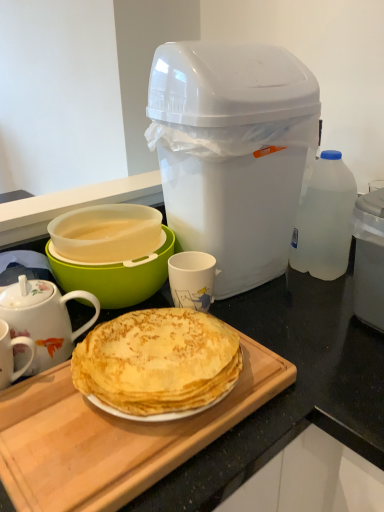
Question: Is wooden cutting board at center shorter than transparent plastic bottle at right?

Choices:
 (A) yes
 (B) no

Answer: (A)

Question: Is wooden cutting board at center positioned before transparent plastic bottle at right?

Choices:
 (A) no
 (B) yes

Answer: (B)

Question: From a real-world perspective, is wooden cutting board at center positioned under transparent plastic bottle at right based on gravity?

Choices:
 (A) no
 (B) yes

Answer: (B)

Question: Is wooden cutting board at center next to transparent plastic bottle at right and touching it?

Choices:
 (A) yes
 (B) no

Answer: (B)

Question: Does wooden cutting board at center turn towards transparent plastic bottle at right?

Choices:
 (A) yes
 (B) no

Answer: (B)

Question: Is translucent plastic bowl at center left in front of or behind white matte mug at center in the image?

Choices:
 (A) behind
 (B) front

Answer: (B)

Question: Considering the positions of point (163, 259) and point (188, 276), is point (163, 259) closer or farther from the camera than point (188, 276)?

Choices:
 (A) closer
 (B) farther

Answer: (B)

Question: Considering the positions of translucent plastic bowl at center left and white matte mug at center in the image, is translucent plastic bowl at center left wider or thinner than white matte mug at center?

Choices:
 (A) thin
 (B) wide

Answer: (B)

Question: From a real-world perspective, is translucent plastic bowl at center left positioned above or below white matte mug at center?

Choices:
 (A) below
 (B) above

Answer: (B)

Question: From the image's perspective, is white plastic trash can at upper right above or below porcelain floral teapot at left?

Choices:
 (A) above
 (B) below

Answer: (A)

Question: Would you say white plastic trash can at upper right is inside or outside porcelain floral teapot at left?

Choices:
 (A) inside
 (B) outside

Answer: (B)

Question: Considering their positions, is white plastic trash can at upper right located in front of or behind porcelain floral teapot at left?

Choices:
 (A) behind
 (B) front

Answer: (A)

Question: Looking at the image, does white plastic trash can at upper right seem bigger or smaller compared to porcelain floral teapot at left?

Choices:
 (A) big
 (B) small

Answer: (A)

Question: Looking at their shapes, would you say translucent plastic bowl at center left is wider or thinner than porcelain floral teapot at left?

Choices:
 (A) wide
 (B) thin

Answer: (A)

Question: Is translucent plastic bowl at center left in front of or behind porcelain floral teapot at left in the image?

Choices:
 (A) behind
 (B) front

Answer: (A)